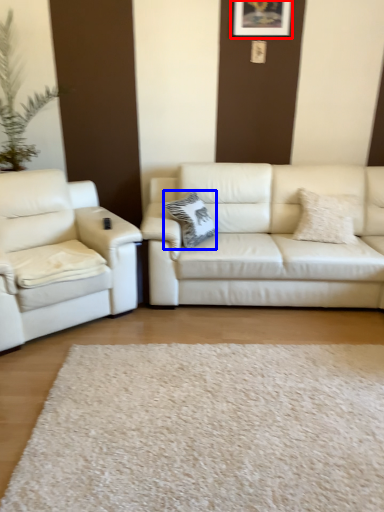
Question: Which point is further to the camera, picture frame (highlighted by a red box) or pillow (highlighted by a blue box)?

Choices:
 (A) picture frame
 (B) pillow

Answer: (A)